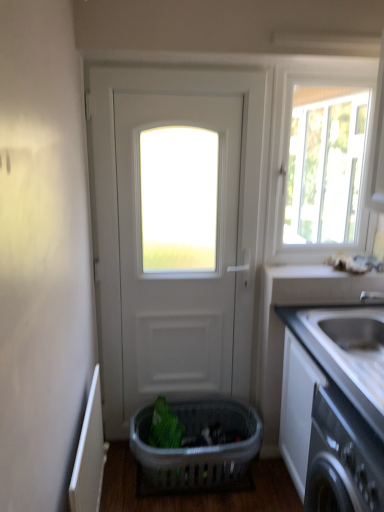
Question: Does point (340, 370) appear closer or farther from the camera than point (332, 97)?

Choices:
 (A) closer
 (B) farther

Answer: (A)

Question: Is white glossy countertop at right to the left or to the right of white glossy window at upper right in the image?

Choices:
 (A) right
 (B) left

Answer: (A)

Question: Estimate the real-world distances between objects in this image. Which object is closer to the white glossy window at upper right?

Choices:
 (A) white matte door at center
 (B) white glossy countertop at right
 (C) plastic basket at center

Answer: (A)

Question: Which of these objects is positioned farthest from the plastic basket at center?

Choices:
 (A) white glossy countertop at right
 (B) white matte door at center
 (C) white glossy window at upper right

Answer: (C)